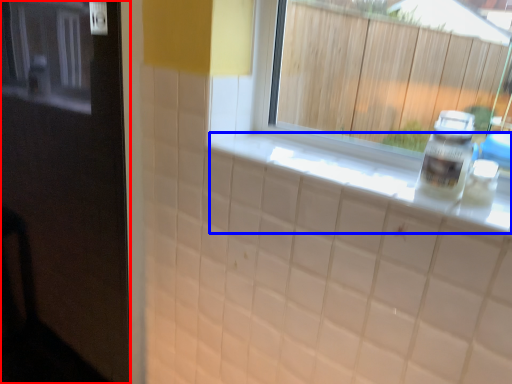
Question: Which point is closer to the camera, door (highlighted by a red box) or counter top (highlighted by a blue box)?

Choices:
 (A) door
 (B) counter top

Answer: (A)